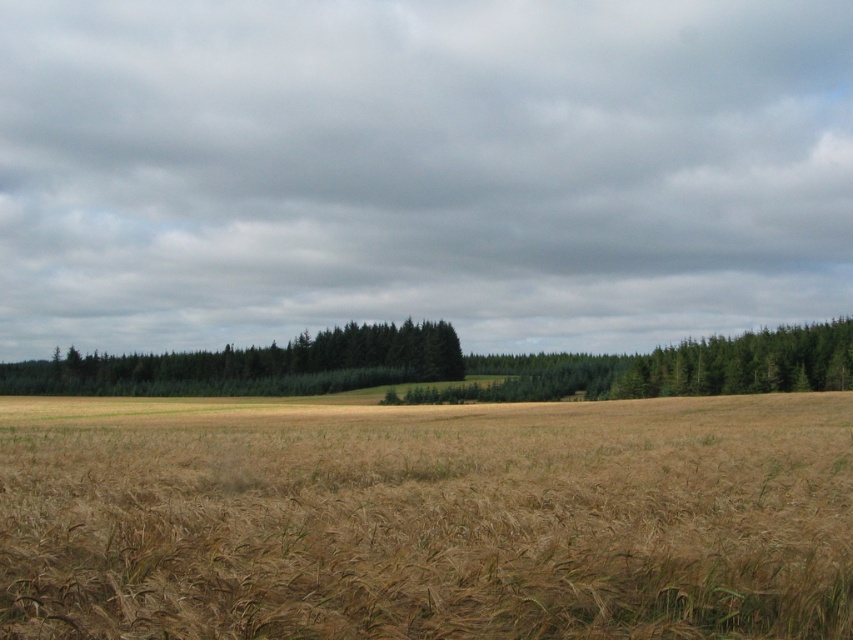
You are standing at the point labeled as point (426, 518) in the image. Looking around, what type of terrain do you see around you?

The point (426, 518) indicates brown grassy field at center, so you are standing in a brown grassy field at center.

You are a farmer planning to plant new crops. You have two areas available in the field, the brown grassy field at center and the green textured trees at center. Which area has more space for planting?

The green textured trees at center has a larger size compared to the brown grassy field at center, so the green textured trees at center area has more space for planting.

What is the 2D coordinate of the brown grassy field at center in the image?

The 2D coordinate of the brown grassy field at center is at point (426, 518).